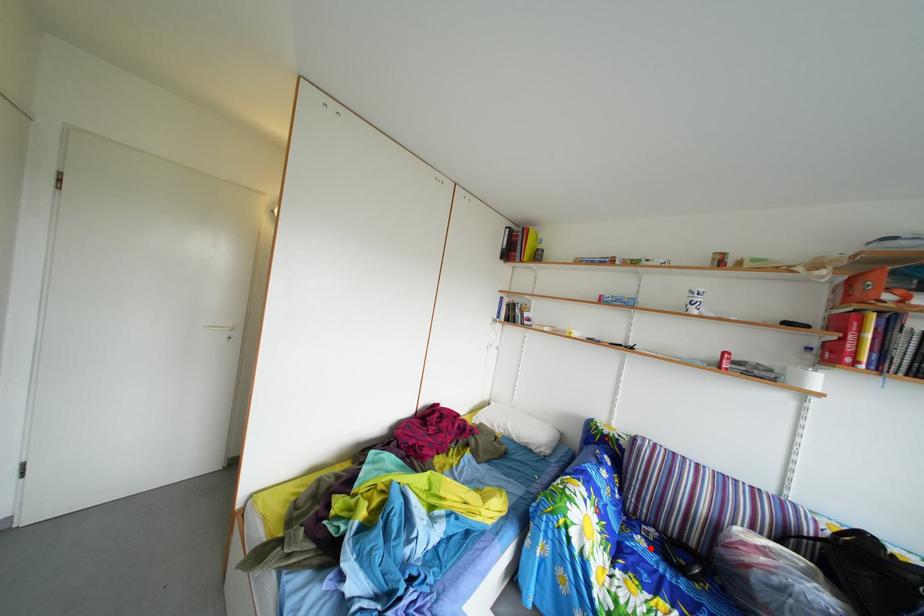
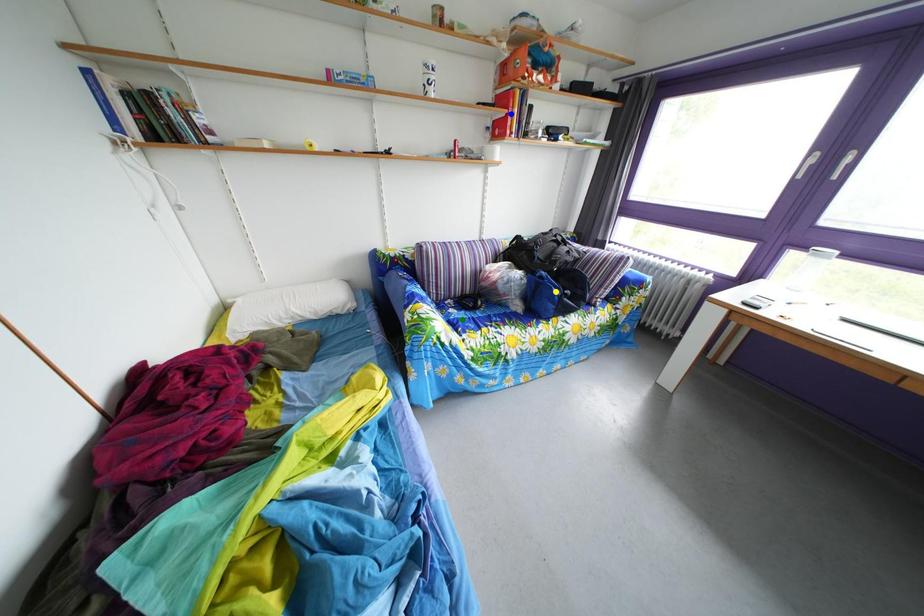
Question: I am providing you with two images of the same scene from different viewpoints. A red point is marked on the first image. You are given multiple points on the second image. Which point in image 2 is actually the same real-world point as the red point in image 1?

Choices:
 (A) blue point
 (B) green point
 (C) yellow point

Answer: (B)